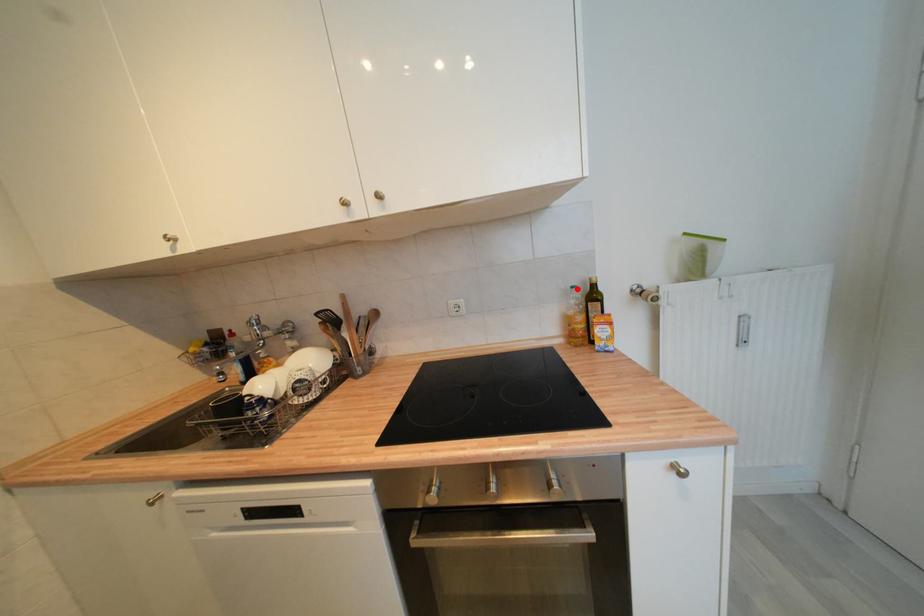
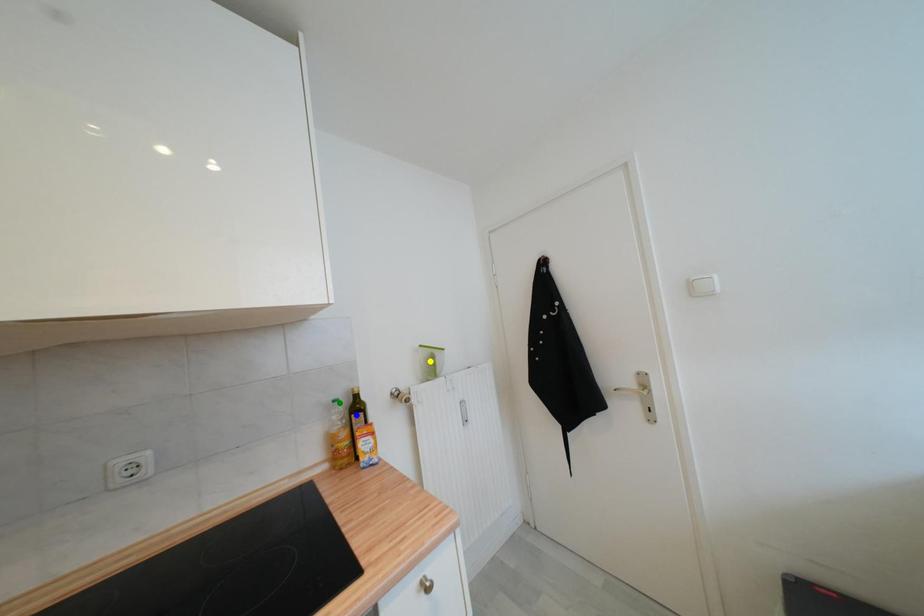
Question: I am providing you with two images of the same scene from different viewpoints. A red point is marked on the first image. You are given multiple points on the second image. Which point in image 2 represents the same 3d spot as the red point in image 1?

Choices:
 (A) green point
 (B) blue point
 (C) yellow point

Answer: (A)